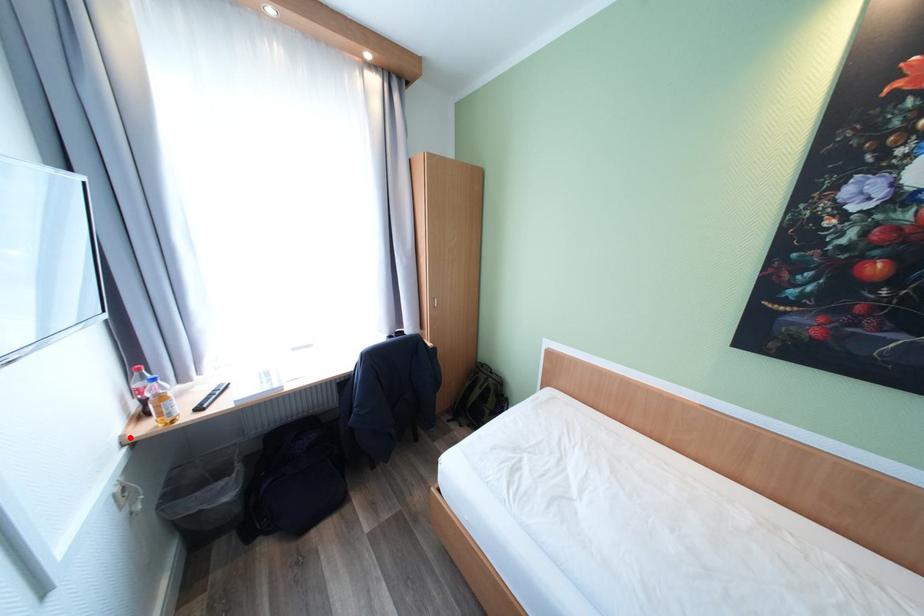
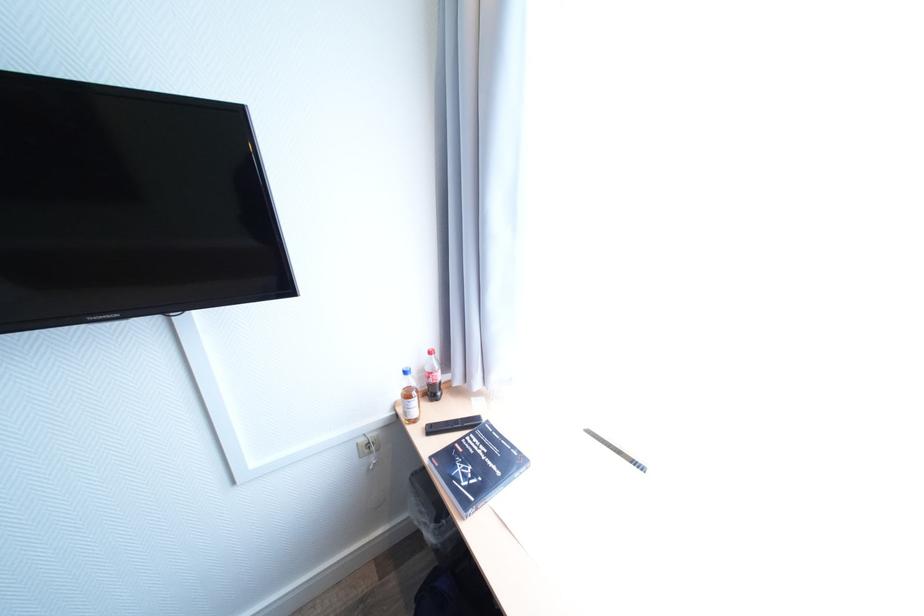
Question: I am providing you with two images of the same scene from different viewpoints. A red point is marked on the first image. Is the red point's position out of view in image 2?

Choices:
 (A) Yes
 (B) No

Answer: (B)